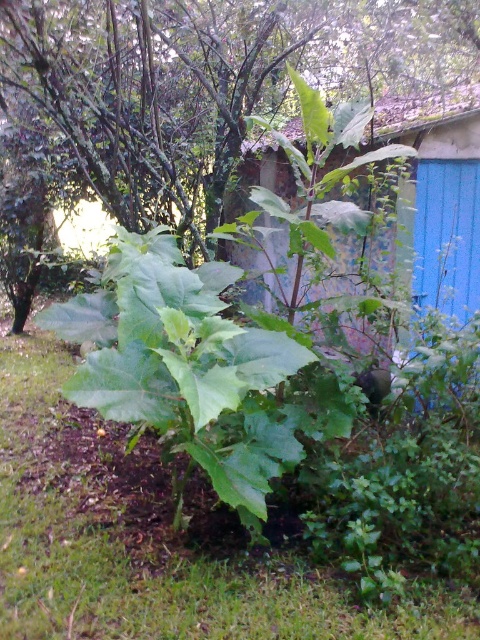
You are a gardener who wants to plant a new flower bed between the green leafy grass at center and the blue painted wood hut at center. Which object should you consider the size of when planning the space?

The green leafy grass at center is smaller than the blue painted wood hut at center, so you should consider the size of the blue painted wood hut at center to ensure there is enough space for the flower bed.

You are a gardener looking at the garden scene. You see the green leafy grass at center and the green leafy plant at center. Which one is located to the left of the other?

The green leafy grass at center is positioned on the left side of green leafy plant at center.